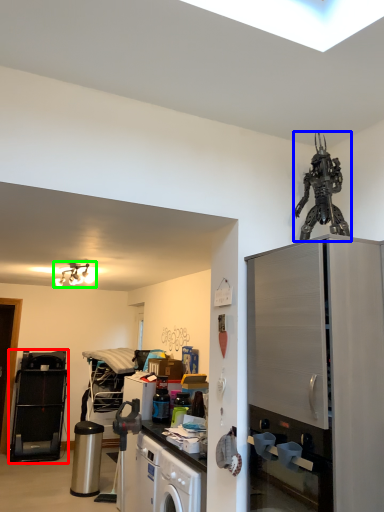
Question: Considering the real-world distances, which object is farthest from appliance (highlighted by a red box)? toy (highlighted by a blue box) or light fixture (highlighted by a green box)?

Choices:
 (A) toy
 (B) light fixture

Answer: (A)